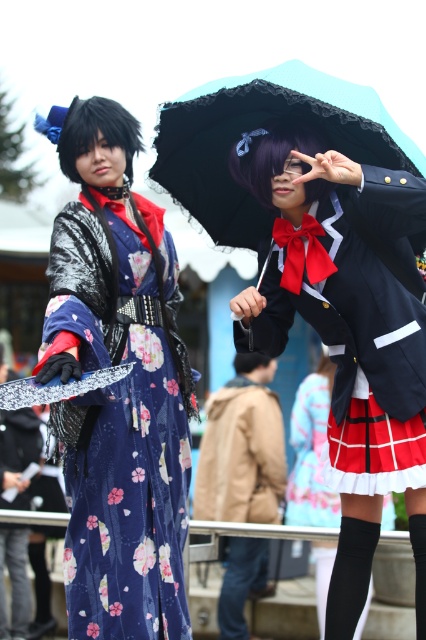
Is point (78, 435) closer to viewer compared to point (316, 81)?

No, (78, 435) is behind (316, 81).

Which of these two, floral silk kimono at center or black lace umbrella at upper center, stands taller?

Standing taller between the two is black lace umbrella at upper center.

Where is `floral silk kimono at center`? floral silk kimono at center is located at coordinates (123, 422).

The height and width of the screenshot is (640, 426). I want to click on floral silk kimono at center, so click(123, 422).

Is point (268, 182) more distant than point (152, 522)?

Yes, point (268, 182) is farther from viewer.

Who is shorter, matte black umbrella at upper center or floral silk kimono at center?

floral silk kimono at center

Which is in front, point (374, 516) or point (183, 474)?

Point (374, 516)

What are the coordinates of `matte black umbrella at upper center` in the screenshot? It's located at (348, 333).

Is matte black umbrella at upper center to the right of black lace umbrella at upper center from the viewer's perspective?

Yes, matte black umbrella at upper center is to the right of black lace umbrella at upper center.

Where is `matte black umbrella at upper center`? The height and width of the screenshot is (640, 426). matte black umbrella at upper center is located at coordinates 348,333.